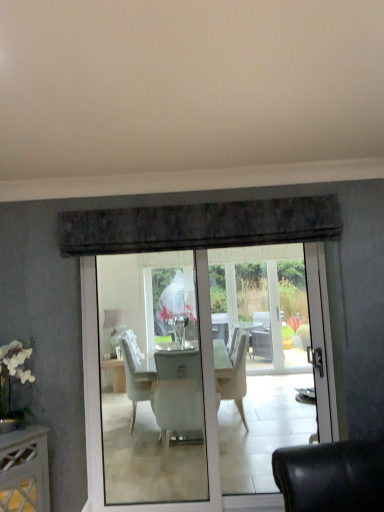
Question: Considering the relative sizes of matte white lampshade at center and translucent glass vase at center in the image provided, is matte white lampshade at center thinner than translucent glass vase at center?

Choices:
 (A) no
 (B) yes

Answer: (B)

Question: From a real-world perspective, is matte white lampshade at center over translucent glass vase at center?

Choices:
 (A) no
 (B) yes

Answer: (A)

Question: Can you confirm if matte white lampshade at center is bigger than translucent glass vase at center?

Choices:
 (A) yes
 (B) no

Answer: (B)

Question: Is matte white lampshade at center next to translucent glass vase at center and touching it?

Choices:
 (A) yes
 (B) no

Answer: (B)

Question: Is matte white lampshade at center positioned in front of translucent glass vase at center?

Choices:
 (A) no
 (B) yes

Answer: (A)

Question: Is matte white lampshade at center positioned with its back to translucent glass vase at center?

Choices:
 (A) yes
 (B) no

Answer: (B)

Question: Can you confirm if translucent glass vase at center is smaller than matte white lampshade at center?

Choices:
 (A) no
 (B) yes

Answer: (A)

Question: Can you confirm if translucent glass vase at center is thinner than matte white lampshade at center?

Choices:
 (A) no
 (B) yes

Answer: (A)

Question: Is translucent glass vase at center shorter than matte white lampshade at center?

Choices:
 (A) no
 (B) yes

Answer: (B)

Question: Can you confirm if translucent glass vase at center is positioned to the left of matte white lampshade at center?

Choices:
 (A) no
 (B) yes

Answer: (A)

Question: Is translucent glass vase at center closer to camera compared to matte white lampshade at center?

Choices:
 (A) no
 (B) yes

Answer: (B)

Question: From a real-world perspective, is translucent glass vase at center on matte white lampshade at center?

Choices:
 (A) no
 (B) yes

Answer: (B)

Question: From their relative heights in the image, would you say matte white lampshade at center is taller or shorter than translucent glass vase at center?

Choices:
 (A) short
 (B) tall

Answer: (B)